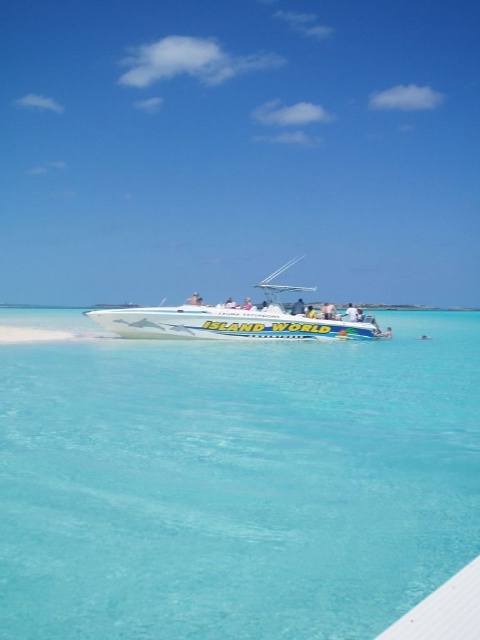
Can you confirm if clear blue water at center is taller than white glossy speedboat at center?

Incorrect, clear blue water at center's height is not larger of white glossy speedboat at center's.

Consider the image. Is the position of clear blue water at center more distant than that of white glossy speedboat at center?

That is False.

Which is behind, point (78, 346) or point (187, 324)?

Point (78, 346)

The width and height of the screenshot is (480, 640). Identify the location of clear blue water at center. (231, 480).